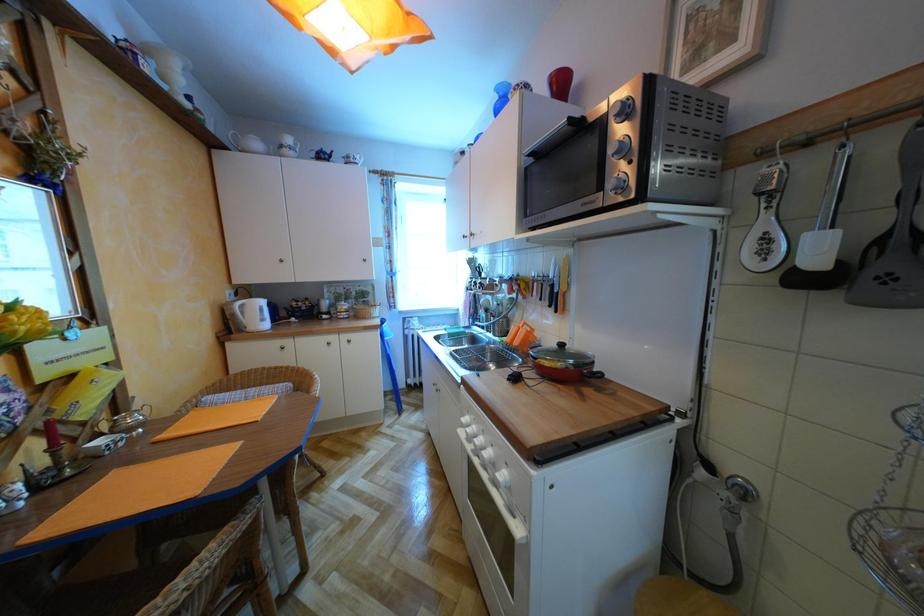
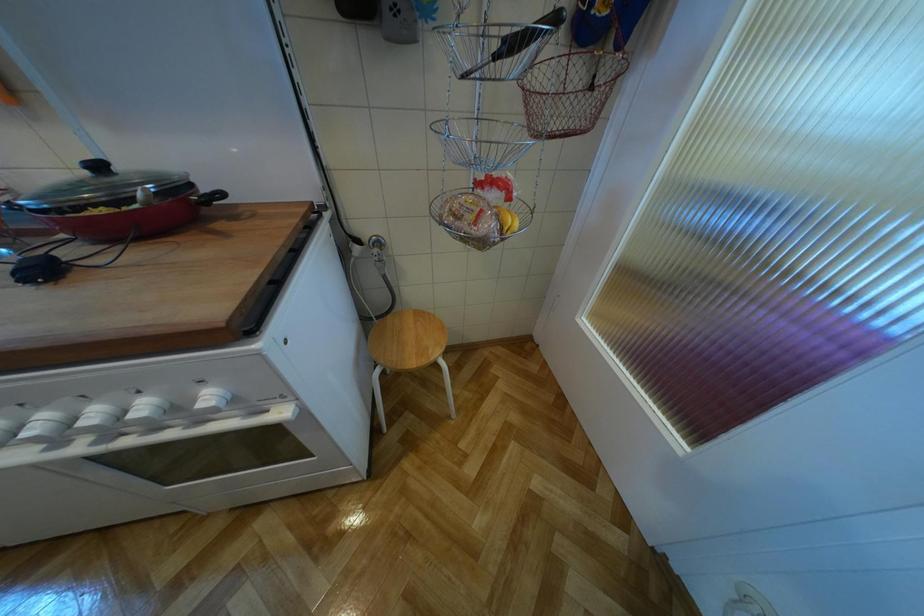
Based on the continuous images, in which direction is the camera rotating?

The rotation direction of the camera is right-down.